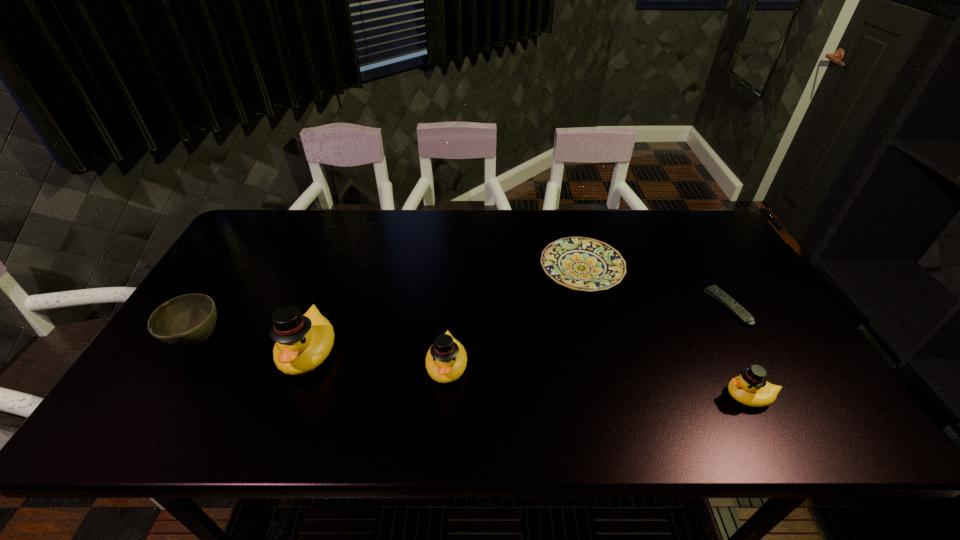
If equal spacing is desired by inserting an extra duck among them, please point out a free spot for this new duck. Please provide its 2D coordinates. Your answer should be formatted as a tuple, i.e. [(x, y)], where the tuple contains the x and y coordinates of a point satisfying the conditions above.

[(593, 381)]